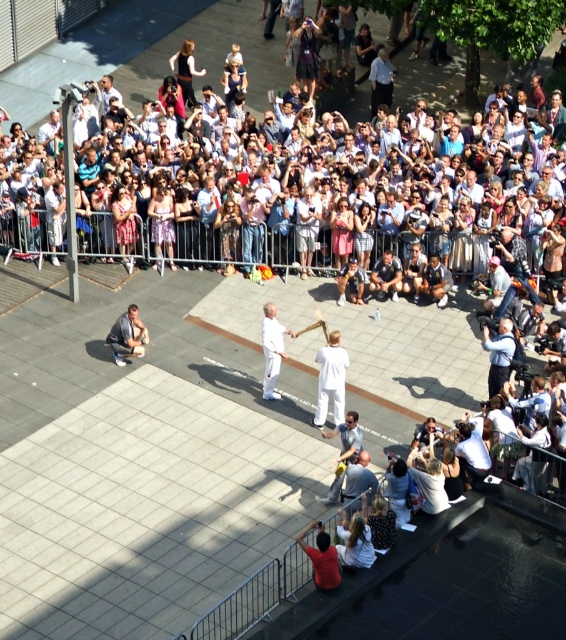
Which is in front, point (302, 241) or point (122, 324)?

Point (122, 324) is in front.

Is point (299, 198) less distant than point (122, 317)?

No, it is not.

Locate an element on the screen. The image size is (566, 640). light brown leather jacket at center is located at coordinates pyautogui.click(x=306, y=228).

Locate an element on the screen. This screenshot has width=566, height=640. light brown leather jacket at center is located at coordinates [306, 228].